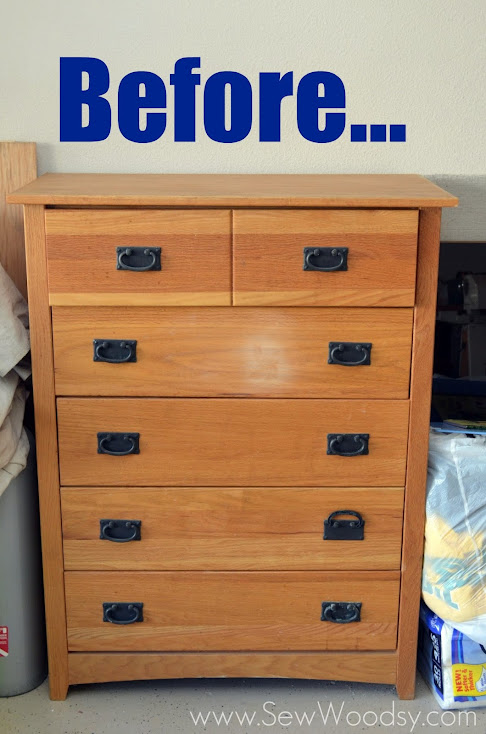
Where is `drawer handle`? drawer handle is located at coordinates (132, 258), (123, 351), (124, 451), (128, 528), (120, 616), (337, 611), (343, 528), (343, 440), (344, 356), (320, 255).